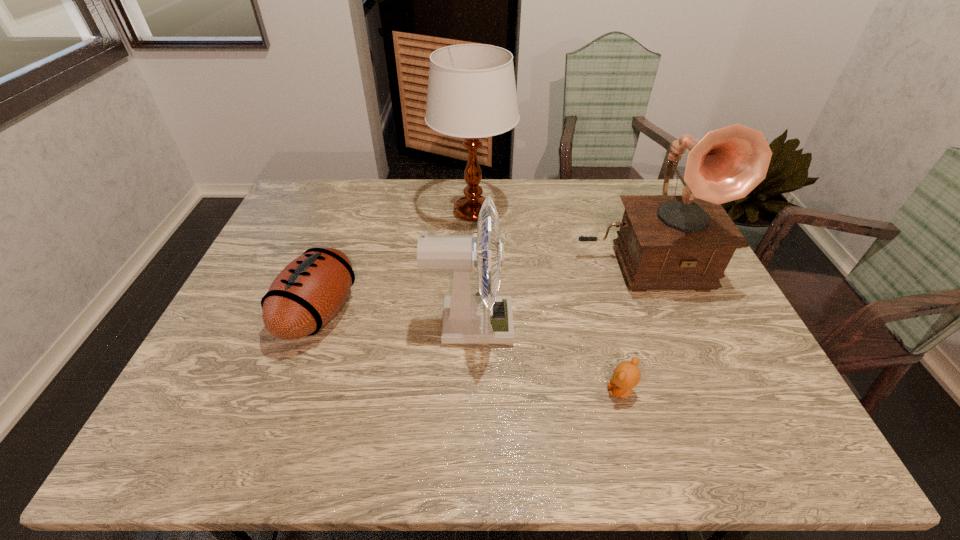
At what (x,y) coordinates should I click in order to perform the action: click on unoccupied area between the leftmost object and the table lamp. Please return your answer as a coordinate pair (x, y). The width and height of the screenshot is (960, 540). Looking at the image, I should click on (396, 262).

Identify which object is located as the third nearest to the third tallest object. Please provide its 2D coordinates. Your answer should be formatted as a tuple, i.e. [(x, y)], where the tuple contains the x and y coordinates of a point satisfying the conditions above.

[(626, 376)]

Point out which object is positioned as the fourth nearest to the football (American). Please provide its 2D coordinates. Your answer should be formatted as a tuple, i.e. [(x, y)], where the tuple contains the x and y coordinates of a point satisfying the conditions above.

[(626, 376)]

I want to click on vacant point that satisfies the following two spatial constraints: 1. on the horn of the record player; 2. on the front-facing side of the fan, so click(x=665, y=325).

I want to click on vacant point that satisfies the following two spatial constraints: 1. on the horn of the record player; 2. on the front-facing side of the fan, so click(665, 325).

Where is `vacant point that satisfies the following two spatial constraints: 1. on the horn of the record player; 2. on the front-facing side of the fan`? vacant point that satisfies the following two spatial constraints: 1. on the horn of the record player; 2. on the front-facing side of the fan is located at coordinates (665, 325).